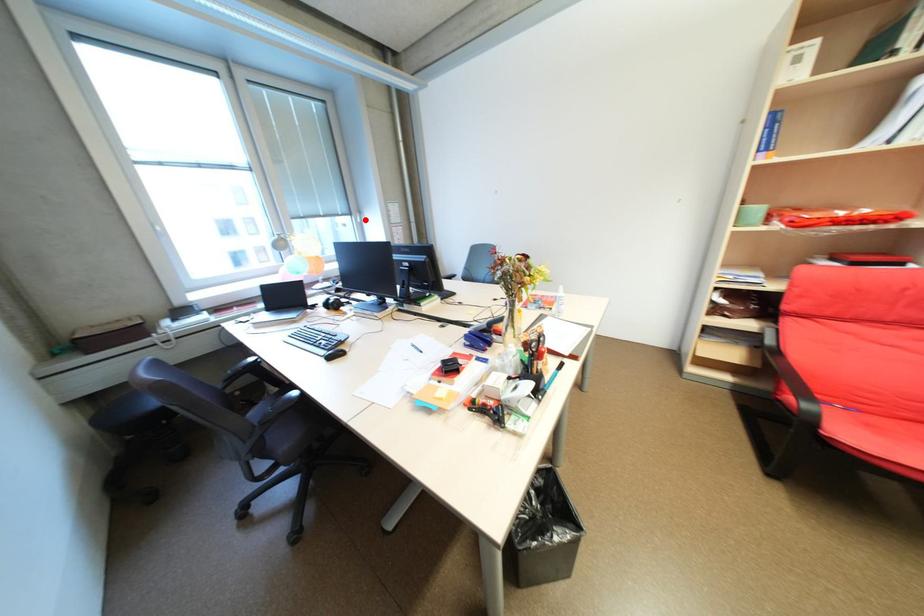
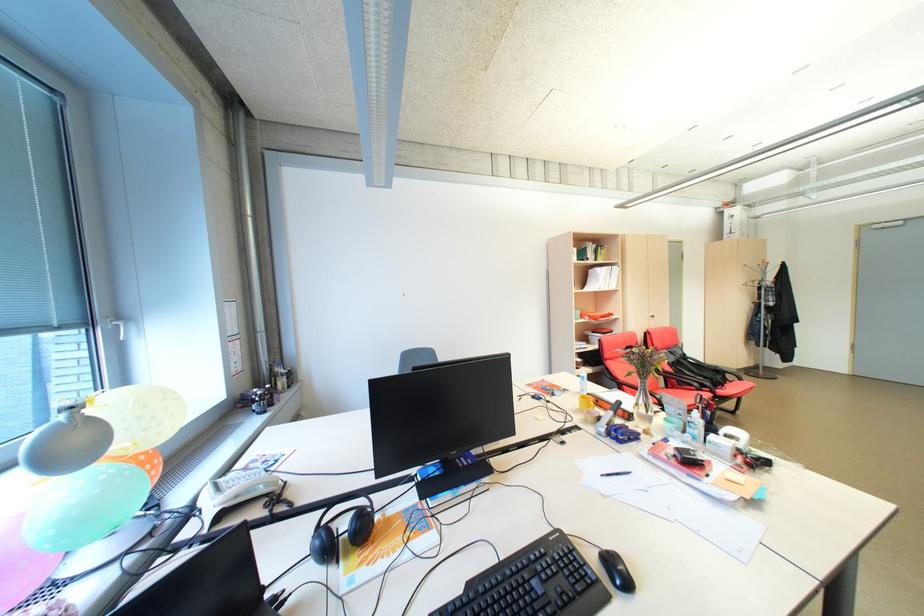
The point at the highlighted location is marked in the first image. Where is the corresponding point in the second image?

(122, 334)